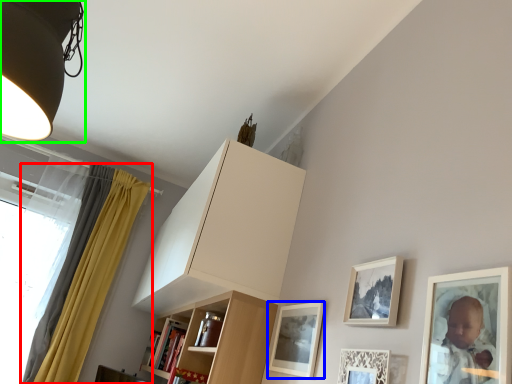
Question: Which object is positioned closest to curtain (highlighted by a red box)? Select from picture frame (highlighted by a blue box) and lamp (highlighted by a green box).

Choices:
 (A) picture frame
 (B) lamp

Answer: (A)